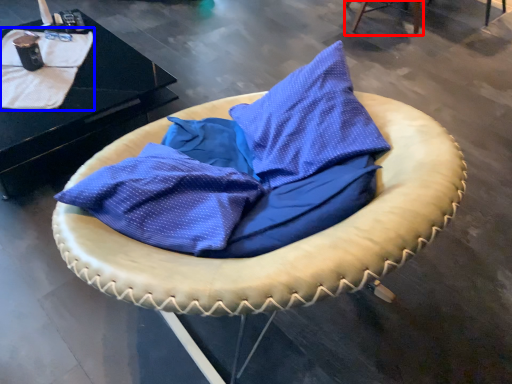
Question: Among these objects, which one is farthest to the camera, furniture (highlighted by a red box) or blanket (highlighted by a blue box)?

Choices:
 (A) furniture
 (B) blanket

Answer: (A)